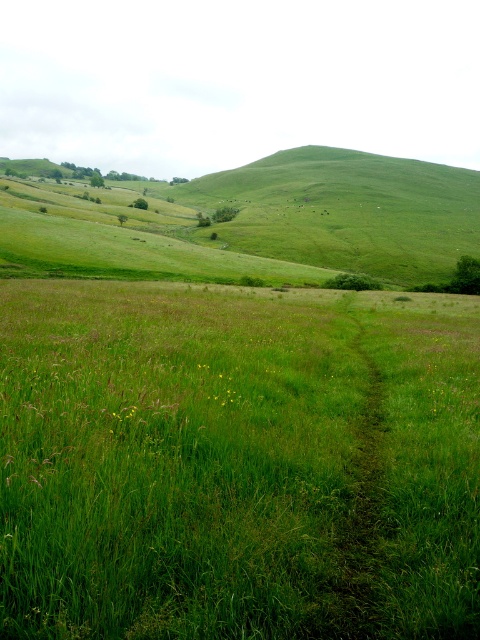
What is the exact coordinate of the green grassy field at center?

The green grassy field at center is located at point [235,467].

You are a hiker who wants to walk through the green grassy field at center and the green grassy trail at center. Which one has a bigger area for you to walk on?

The green grassy field at center is larger in size than the green grassy trail at center, so the field has a bigger area for walking.

You are a hiker standing on the green grassy field at center and want to walk to the green grassy trail at center. Which direction should you walk to reach the trail?

The green grassy field at center is to the left of the green grassy trail at center, so you should walk to the right to reach the trail.